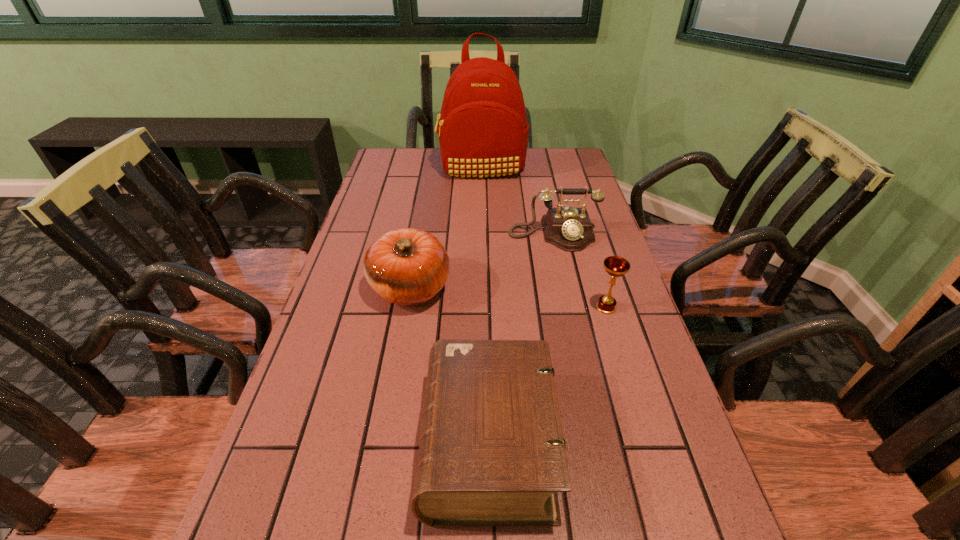
Find the location of a particular element. This screenshot has height=540, width=960. free space at the far right corner of the desktop is located at coordinates (568, 164).

Locate an element on the screen. free space between the tallest object and the nearest object is located at coordinates (485, 306).

Identify the location of empty space that is in between the chalice and the tallest object. This screenshot has height=540, width=960. (544, 238).

You are a GUI agent. You are given a task and a screenshot of the screen. Output one action in this format:
    pyautogui.click(x=<x>, y=<y>)
    Task: Click on the vacant area between the backpack and the second farthest object
    This screenshot has width=960, height=540.
    Given the screenshot: What is the action you would take?
    pyautogui.click(x=517, y=201)

Locate an element on the screen. This screenshot has height=540, width=960. vacant point located between the pumpkin and the tallest object is located at coordinates (445, 228).

In order to click on vacant point located between the tallest object and the pumpkin in this screenshot , I will do `click(445, 228)`.

Where is `free space between the Bible and the farthest object`? free space between the Bible and the farthest object is located at coordinates (485, 306).

You are a GUI agent. You are given a task and a screenshot of the screen. Output one action in this format:
    pyautogui.click(x=<x>, y=<y>)
    Task: Click on the vacant space that is in between the chalice and the telephone
    
    Given the screenshot: What is the action you would take?
    pyautogui.click(x=580, y=271)

The width and height of the screenshot is (960, 540). What are the coordinates of `object that stands as the fourth closest to the fourth nearest object` in the screenshot? It's located at (492, 452).

Choose which object is the fourth nearest neighbor to the nearest object. Please provide its 2D coordinates. Your answer should be formatted as a tuple, i.e. [(x, y)], where the tuple contains the x and y coordinates of a point satisfying the conditions above.

[(483, 131)]